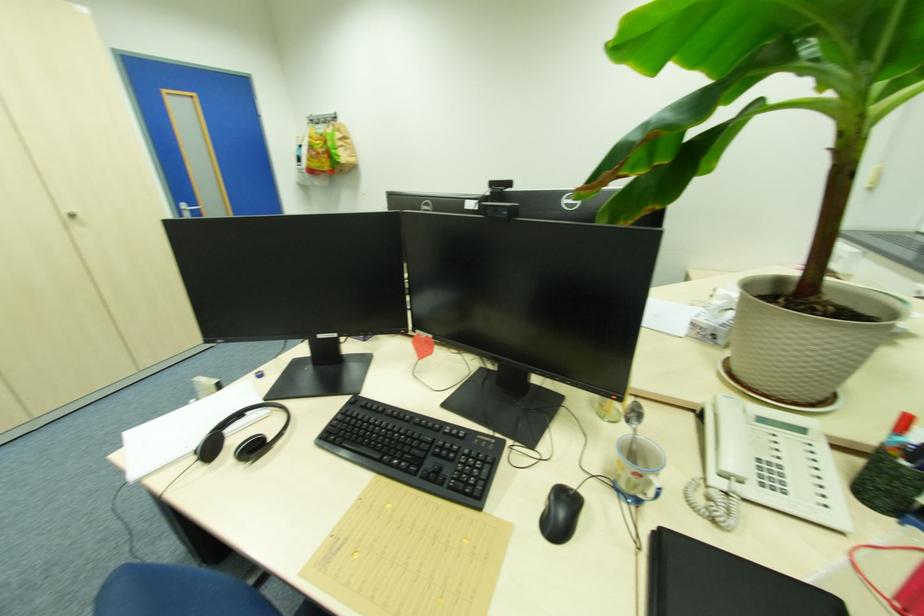
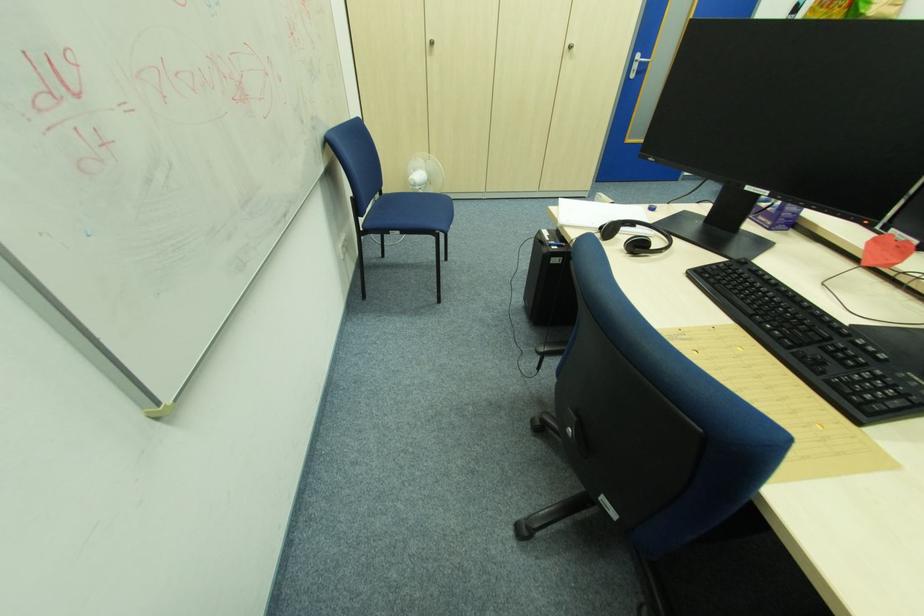
First-person continuous shooting, in which direction is the camera rotating?

The rotation direction of the camera is left-down.